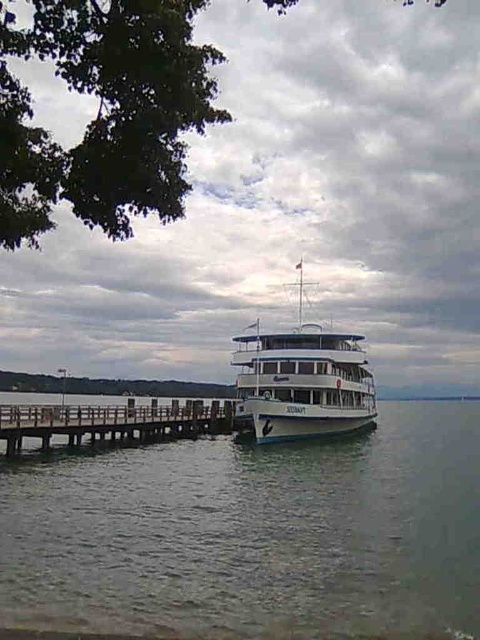
Does clear water at dock right have a smaller size compared to brown wooden dock at lower left?

Yes, clear water at dock right is smaller than brown wooden dock at lower left.

Is point (389, 554) positioned after point (61, 429)?

That is False.

Between point (406, 474) and point (107, 413), which one is positioned in front?

Positioned in front is point (406, 474).

Where is `clear water at dock right`? This screenshot has width=480, height=640. clear water at dock right is located at coordinates (256, 532).

Who is more distant from viewer, (276,333) or (191,432)?

The point (191,432) is more distant.

Between white glossy cruise ship at center and brown wooden dock at lower left, which one is positioned lower?

brown wooden dock at lower left

This screenshot has height=640, width=480. I want to click on white glossy cruise ship at center, so [300, 381].

Is clear water at dock right to the left of white glossy cruise ship at center from the viewer's perspective?

Correct, you'll find clear water at dock right to the left of white glossy cruise ship at center.

Is clear water at dock right positioned in front of white glossy cruise ship at center?

That is True.

Is point (148, 522) farther from viewer compared to point (312, 346)?

That is False.

Locate an element on the screen. clear water at dock right is located at coordinates click(x=256, y=532).